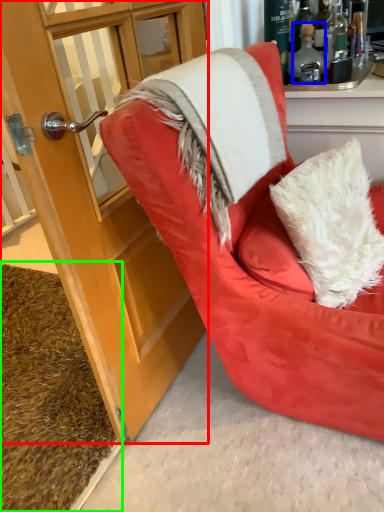
Question: Estimate the real-world distances between objects in this image. Which object is closer to cabinetry (highlighted by a red box), bottle (highlighted by a blue box) or doormat (highlighted by a green box)?

Choices:
 (A) bottle
 (B) doormat

Answer: (B)